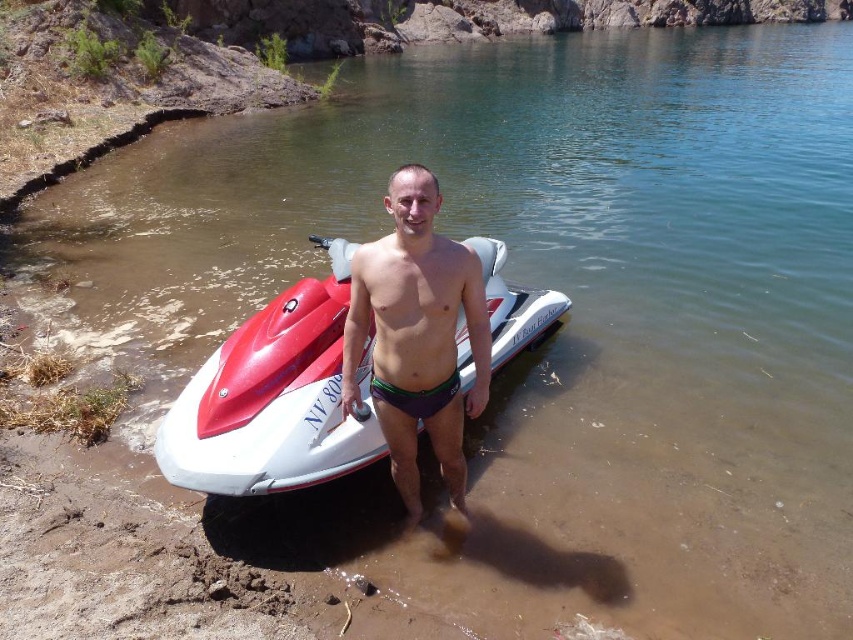
Question: Does red glossy jet ski at center appear on the right side of purple matte swim trunks at center?

Choices:
 (A) yes
 (B) no

Answer: (B)

Question: Which of the following is the farthest from the observer?

Choices:
 (A) purple matte swim trunks at center
 (B) red glossy jet ski at center

Answer: (B)

Question: Which of the following is the closest to the observer?

Choices:
 (A) purple matte swim trunks at center
 (B) red glossy jet ski at center

Answer: (A)

Question: Which object is farther from the camera taking this photo?

Choices:
 (A) purple matte swim trunks at center
 (B) red glossy jet ski at center

Answer: (B)

Question: Where is red glossy jet ski at center located in relation to purple matte swim trunks at center in the image?

Choices:
 (A) left
 (B) right

Answer: (A)

Question: Considering the relative positions of red glossy jet ski at center and purple matte swim trunks at center in the image provided, where is red glossy jet ski at center located with respect to purple matte swim trunks at center?

Choices:
 (A) left
 (B) right

Answer: (A)